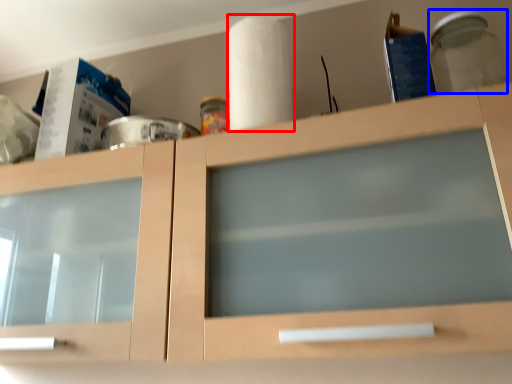
Question: Which point is closer to the camera, paper towel (highlighted by a red box) or glass jar (highlighted by a blue box)?

Choices:
 (A) paper towel
 (B) glass jar

Answer: (B)